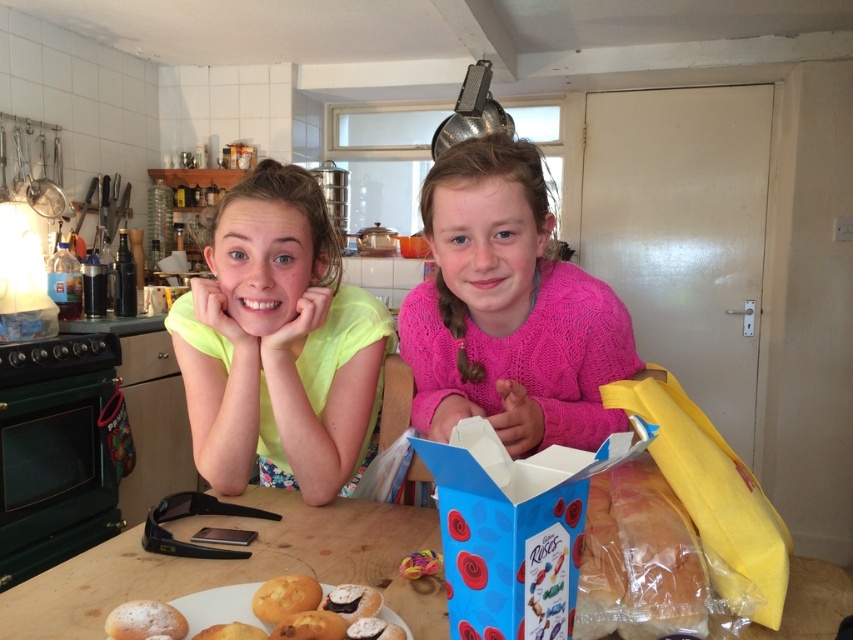
Is pink knitted sweater at center thinner than golden brown bread at lower left?

In fact, pink knitted sweater at center might be wider than golden brown bread at lower left.

Does pink knitted sweater at center come behind golden brown bread at lower left?

Yes, pink knitted sweater at center is behind golden brown bread at lower left.

The height and width of the screenshot is (640, 853). What are the coordinates of `pink knitted sweater at center` in the screenshot? It's located at (508, 310).

Between neon yellow shirt at center and blue cardboard box at center, which one is positioned higher?

Positioned higher is neon yellow shirt at center.

Who is shorter, neon yellow shirt at center or blue cardboard box at center?

blue cardboard box at center

Between point (343, 422) and point (518, 502), which one is positioned in front?

Point (518, 502) is in front.

Find the location of a particular element. The image size is (853, 640). neon yellow shirt at center is located at coordinates (279, 344).

In the scene shown: Which is above, wooden table at center or golden brown bread at lower left?

Positioned higher is golden brown bread at lower left.

Who is more forward, [358,570] or [148,627]?

Point [148,627] is in front.

The height and width of the screenshot is (640, 853). Identify the location of wooden table at center. (236, 566).